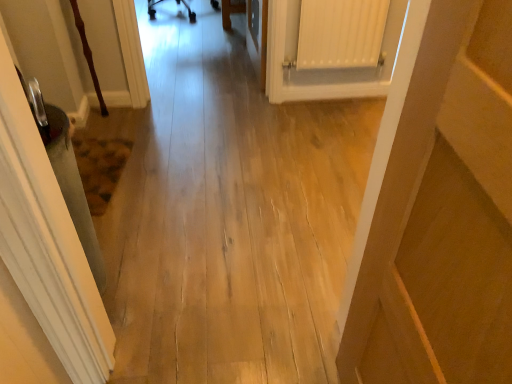
Consider the image. Measure the distance between wooden door at right and camera.

wooden door at right is 49.71 centimeters from camera.

Image resolution: width=512 pixels, height=384 pixels. Identify the location of light wood floor at center. (229, 216).

The image size is (512, 384). What are the coordinates of `wooden door at right` in the screenshot? It's located at (438, 209).

Consider the image. Is white matte radiator at upper right to the left or to the right of light wood floor at center in the image?

Clearly, white matte radiator at upper right is on the right of light wood floor at center in the image.

Considering the relative sizes of white matte radiator at upper right and light wood floor at center in the image provided, is white matte radiator at upper right thinner than light wood floor at center?

Yes, white matte radiator at upper right is thinner than light wood floor at center.

Does point (325, 66) lie in front of point (127, 318)?

No, it is not.

Is point (510, 26) behind point (176, 381)?

That is False.

From a real-world perspective, which is physically above, wooden door at right or light wood floor at center?

wooden door at right.

In terms of height, does wooden door at right look taller or shorter compared to light wood floor at center?

wooden door at right is taller than light wood floor at center.

In order to click on path behind the wooden door at right in this screenshot , I will do [x=229, y=216].

Visually, is light wood floor at center positioned to the left or to the right of white matte radiator at upper right?

light wood floor at center is to the left of white matte radiator at upper right.

From a real-world perspective, does light wood floor at center stand above white matte radiator at upper right?

Yes.

Can you confirm if light wood floor at center is thinner than white matte radiator at upper right?

In fact, light wood floor at center might be wider than white matte radiator at upper right.

From the image's perspective, is white matte radiator at upper right over wooden door at right?

Yes, from the image's perspective, white matte radiator at upper right is above wooden door at right.

Between white matte radiator at upper right and wooden door at right, which one has less height?

white matte radiator at upper right.

Which is behind, white matte radiator at upper right or wooden door at right?

Positioned behind is white matte radiator at upper right.

Considering the sizes of objects white matte radiator at upper right and wooden door at right in the image provided, who is wider, white matte radiator at upper right or wooden door at right?

With larger width is wooden door at right.

Between light wood floor at center and wooden door at right, which one has more height?

Standing taller between the two is wooden door at right.

Would you consider light wood floor at center to be distant from wooden door at right?

No, light wood floor at center is in close proximity to wooden door at right.

Identify the location of path to the left of wooden door at right. (229, 216).

Is wooden door at right outside of white matte radiator at upper right?

Yes, wooden door at right is not within white matte radiator at upper right.

Which of these two, wooden door at right or white matte radiator at upper right, is wider?

wooden door at right.

Is the position of wooden door at right more distant than that of white matte radiator at upper right?

No, the depth of wooden door at right is less than that of white matte radiator at upper right.

The width and height of the screenshot is (512, 384). In order to click on door below the white matte radiator at upper right (from the image's perspective) in this screenshot , I will do `click(438, 209)`.

In order to click on path in front of the white matte radiator at upper right in this screenshot , I will do `click(229, 216)`.

This screenshot has width=512, height=384. I want to click on path located behind the wooden door at right, so click(229, 216).

Considering their positions, is white matte radiator at upper right positioned further to wooden door at right than light wood floor at center?

white matte radiator at upper right is positioned further to the anchor wooden door at right.

Which object lies nearer to the anchor point light wood floor at center, wooden door at right or white matte radiator at upper right?

white matte radiator at upper right lies closer to light wood floor at center than the other object.

When comparing their distances from white matte radiator at upper right, does wooden door at right or light wood floor at center seem closer?

light wood floor at center is positioned closer to the anchor white matte radiator at upper right.

Which object lies further to the anchor point wooden door at right, light wood floor at center or white matte radiator at upper right?

white matte radiator at upper right is further to wooden door at right.

Estimate the real-world distances between objects in this image. Which object is closer to white matte radiator at upper right, light wood floor at center or wooden door at right?

Among the two, light wood floor at center is located nearer to white matte radiator at upper right.

Estimate the real-world distances between objects in this image. Which object is closer to light wood floor at center, white matte radiator at upper right or wooden door at right?

white matte radiator at upper right lies closer to light wood floor at center than the other object.

Find the location of a particular element. The height and width of the screenshot is (384, 512). path between wooden door at right and white matte radiator at upper right in the front-back direction is located at coordinates (229, 216).